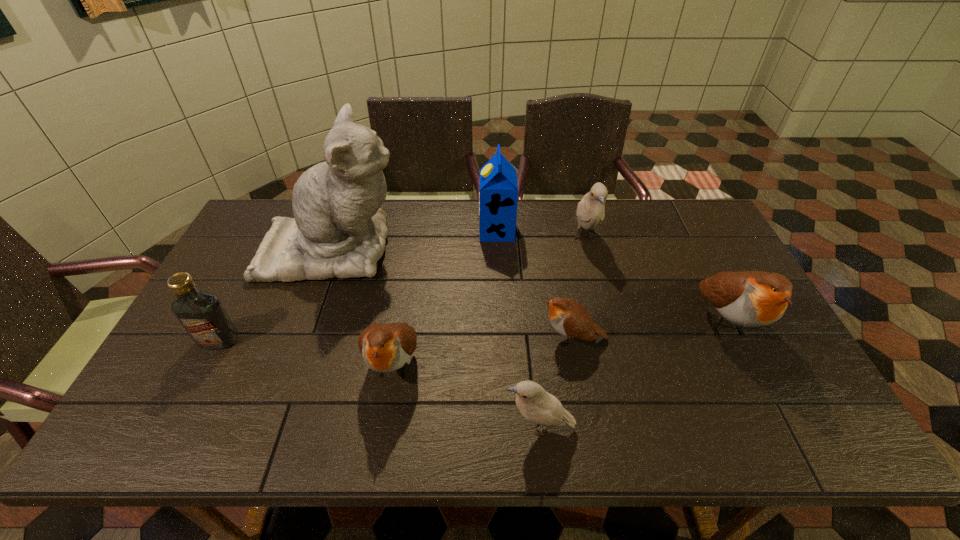
At what (x,y) coordinates should I click in order to perform the action: click on free space between the shortest bird and the carton. Please return your answer as a coordinate pair (x, y). This screenshot has height=540, width=960. Looking at the image, I should click on (535, 284).

You are a GUI agent. You are given a task and a screenshot of the screen. Output one action in this format:
    pyautogui.click(x=<x>, y=<y>)
    Task: Click on the free space between the leftmost brown bird and the smaller white bird
    
    Given the screenshot: What is the action you would take?
    pyautogui.click(x=467, y=395)

In order to click on free space between the carton and the leftmost brown bird in this screenshot , I will do `click(445, 297)`.

The image size is (960, 540). What are the coordinates of `vacant space in between the biggest brown bird and the carton` in the screenshot? It's located at (611, 276).

Find the location of a particular element. The image size is (960, 540). free space between the cat and the rightmost brown bird is located at coordinates (528, 285).

You are a GUI agent. You are given a task and a screenshot of the screen. Output one action in this format:
    pyautogui.click(x=<x>, y=<y>)
    Task: Click on the empty space that is in between the second brown bird from right to left and the bigger white bird
    This screenshot has width=960, height=540.
    Given the screenshot: What is the action you would take?
    pyautogui.click(x=579, y=288)

Identify the location of vacant space that's between the second brown bird from left to right and the bigger white bird. (579, 288).

The image size is (960, 540). I want to click on free point between the tallest object and the second biggest brown bird, so click(364, 306).

Locate an element on the screen. This screenshot has width=960, height=540. free space between the nearer white bird and the vodka is located at coordinates (379, 384).

The height and width of the screenshot is (540, 960). In order to click on empty space that is in between the vodka and the rightmost brown bird in this screenshot , I will do `click(471, 330)`.